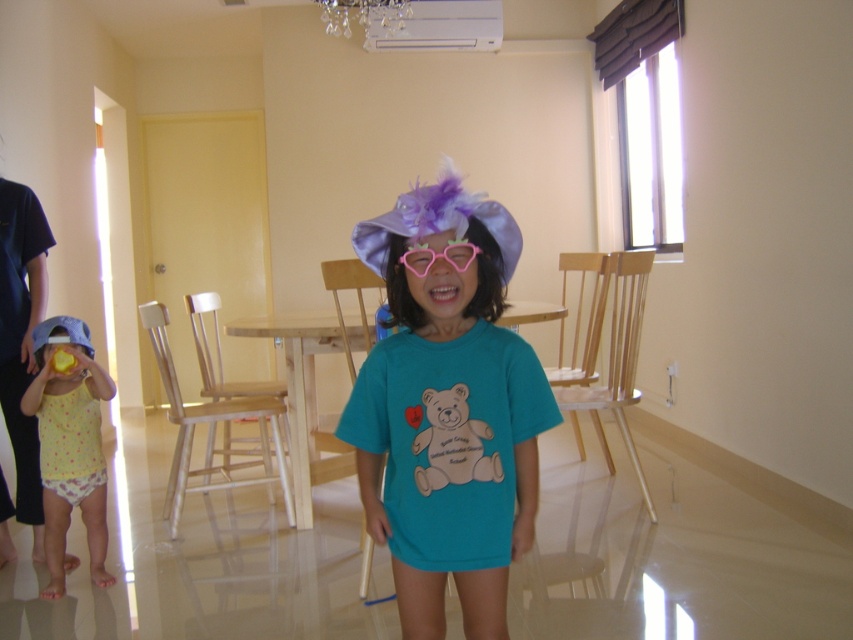
Question: Among these objects, which one is nearest to the camera?

Choices:
 (A) matte purple hat at center
 (B) pink plastic goggles at center
 (C) yellow dotted fabric at left

Answer: (A)

Question: Can you confirm if matte purple hat at center is thinner than pink plastic goggles at center?

Choices:
 (A) no
 (B) yes

Answer: (A)

Question: Can you confirm if matte purple hat at center is bigger than yellow dotted fabric at left?

Choices:
 (A) no
 (B) yes

Answer: (B)

Question: Estimate the real-world distances between objects in this image. Which object is farther from the yellow dotted fabric at left?

Choices:
 (A) pink plastic goggles at center
 (B) matte purple hat at center

Answer: (A)

Question: Observing the image, what is the correct spatial positioning of matte purple hat at center in reference to pink plastic goggles at center?

Choices:
 (A) right
 (B) left

Answer: (A)

Question: Estimate the real-world distances between objects in this image. Which object is farther from the pink plastic goggles at center?

Choices:
 (A) yellow dotted fabric at left
 (B) matte purple hat at center

Answer: (A)